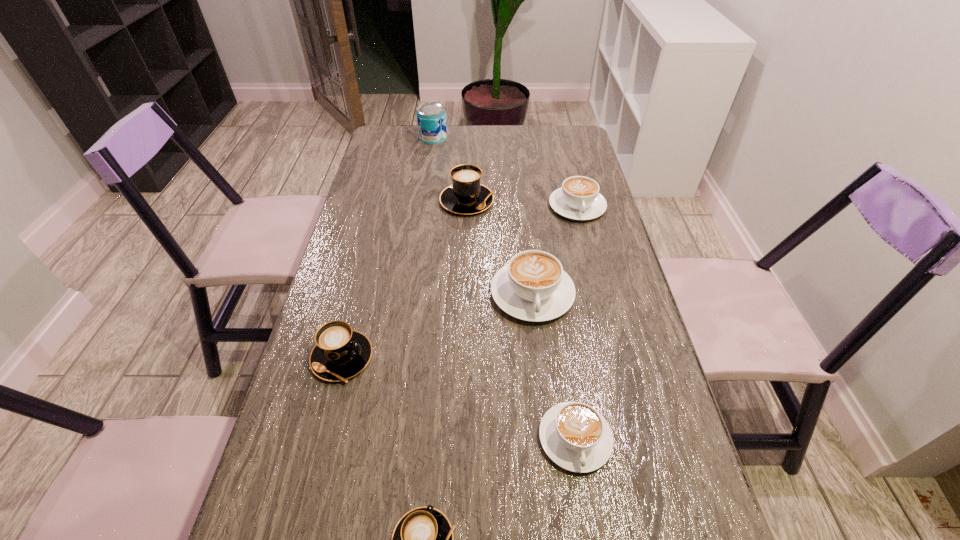
Find the location of `free space located 0.290m on the right of the blue can`. free space located 0.290m on the right of the blue can is located at coordinates (522, 137).

Locate an element on the screen. vacant space located 0.180m on the left of the farthest black cappuccino is located at coordinates (384, 201).

Where is `vacant space situated 0.290m on the side of the fourth nearest cappuccino with the handle`? Image resolution: width=960 pixels, height=540 pixels. vacant space situated 0.290m on the side of the fourth nearest cappuccino with the handle is located at coordinates [x=549, y=444].

At what (x,y) coordinates should I click in order to perform the action: click on vacant space located on the right of the leftmost cappuccino. Please return your answer as a coordinate pair (x, y). Image resolution: width=960 pixels, height=540 pixels. Looking at the image, I should click on (456, 358).

Where is `vacant position located 0.050m on the side of the farthest white cappuccino with the handle`? The image size is (960, 540). vacant position located 0.050m on the side of the farthest white cappuccino with the handle is located at coordinates (585, 235).

Locate an element on the screen. The height and width of the screenshot is (540, 960). vacant space positioned 0.100m on the side of the second nearest cappuccino with the handle is located at coordinates (589, 536).

What are the coordinates of `object present at the far edge` in the screenshot? It's located at (431, 117).

The image size is (960, 540). What are the coordinates of `can that is at the left edge` in the screenshot? It's located at (431, 117).

Locate an element on the screen. The height and width of the screenshot is (540, 960). cappuccino located in the left edge section of the desktop is located at coordinates (340, 353).

The width and height of the screenshot is (960, 540). I want to click on object present at the far left corner, so click(431, 117).